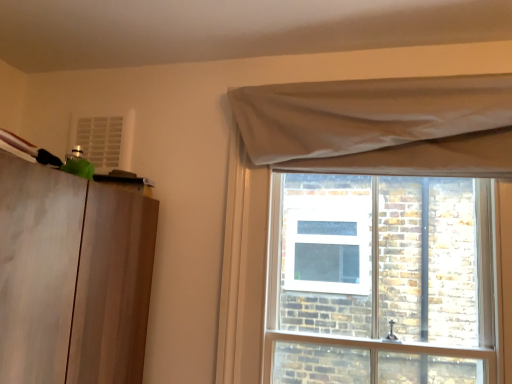
What do you see at coordinates (381, 126) in the screenshot? This screenshot has height=384, width=512. I see `beige sheer curtain at upper right` at bounding box center [381, 126].

Locate an element on the screen. beige sheer curtain at upper right is located at coordinates (381, 126).

Locate an element on the screen. Image resolution: width=512 pixels, height=384 pixels. beige sheer curtain at upper right is located at coordinates (381, 126).